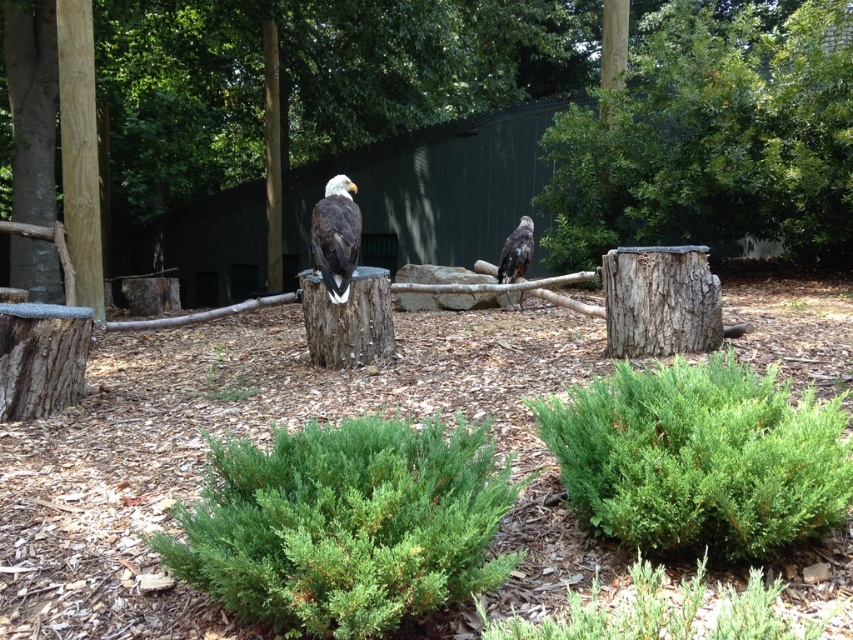
Can you confirm if green leafy bush at upper right is wider than green fuzzy bush at lower center?

Incorrect, green leafy bush at upper right's width does not surpass green fuzzy bush at lower center's.

Which is in front, point (756, 54) or point (361, 442)?

Point (361, 442) is in front.

I want to click on green leafy bush at upper right, so click(711, 138).

Is point (329, 243) positioned after point (265, 10)?

No, (329, 243) is in front of (265, 10).

Who is shorter, dark brown feathers at center or brown wood pole at center?

dark brown feathers at center

Which is behind, point (354, 214) or point (277, 214)?

The point (277, 214) is behind.

You are a GUI agent. You are given a task and a screenshot of the screen. Output one action in this format:
    pyautogui.click(x=<x>, y=<y>)
    Task: Click on the dark brown feathers at center
    This screenshot has height=640, width=853.
    Given the screenshot: What is the action you would take?
    pyautogui.click(x=335, y=236)

Is point (593, 504) positioned in front of point (265, 211)?

Yes, it is in front of point (265, 211).

Does point (643, 372) lie behind point (271, 269)?

No, (643, 372) is closer to viewer.

At what (x,y) coordinates should I click in order to perform the action: click on green leafy bush at lower center. Please return your answer as a coordinate pair (x, y). This screenshot has height=640, width=853. Looking at the image, I should click on [x=699, y=456].